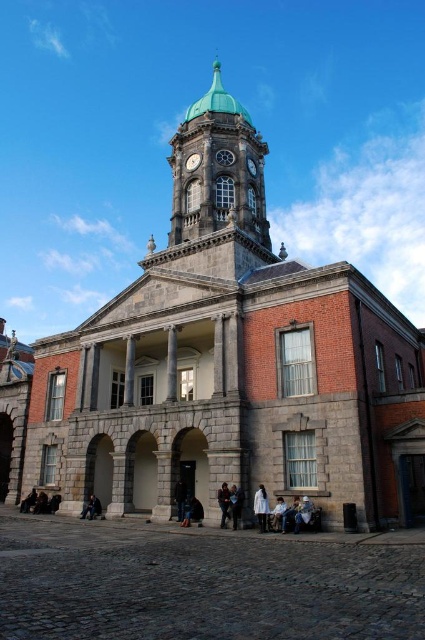
You are standing in front of the historic building and notice the green copper dome at upper center and the leather jacket at lower center. Which object is positioned higher up in the scene?

The green copper dome at upper center is positioned higher up in the scene than the leather jacket at lower center.

You are standing in front of the historic building and want to know which object is bigger between the green copper dome at upper center and the light brown leather jacket at lower center. Can you tell me?

The green copper dome at upper center has a larger size compared to the light brown leather jacket at lower center, so the green copper dome at upper center is bigger.

You are a visitor standing in front of the historic building and notice the green copper dome at upper center and the leather jacket at lower center. Which object is higher up in the image?

The green copper dome at upper center is taller than the leather jacket at lower center, so the green copper dome at upper center is higher up in the image.